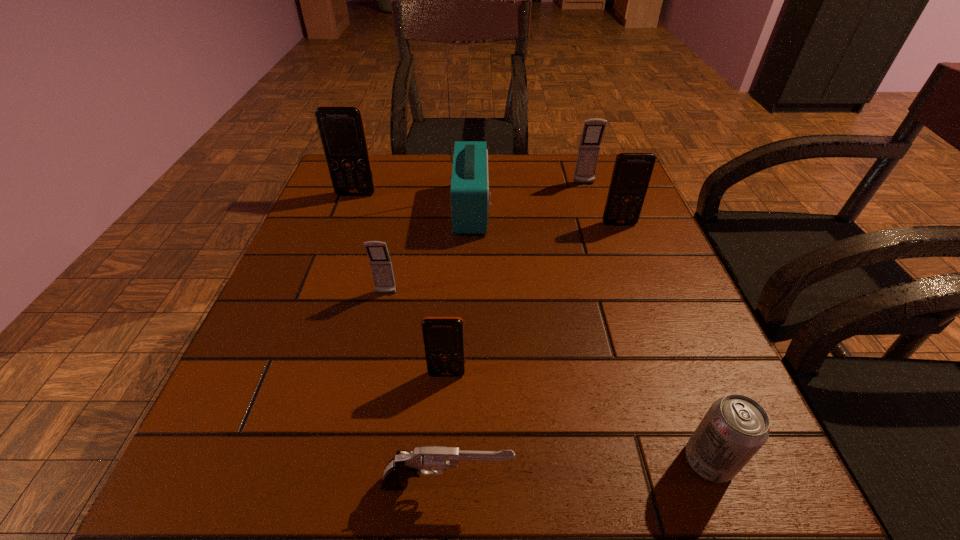
Where is `the left gray cellular telephone`? The image size is (960, 540). the left gray cellular telephone is located at coordinates (380, 262).

You are a GUI agent. You are given a task and a screenshot of the screen. Output one action in this format:
    pyautogui.click(x=<x>, y=<y>)
    Task: Click on the smaller gray cellular telephone
    Image resolution: width=960 pixels, height=540 pixels.
    Given the screenshot: What is the action you would take?
    pyautogui.click(x=380, y=262)

Find the location of `soda can`. soda can is located at coordinates (735, 427).

You are a GUI agent. You are given a task and a screenshot of the screen. Output one action in this format:
    pyautogui.click(x=<x>, y=<y>)
    Task: Click on the shortest object
    
    Given the screenshot: What is the action you would take?
    pyautogui.click(x=404, y=465)

Find the location of a particular element. vacant space situated 0.120m on the front panel of the tallest object is located at coordinates (540, 209).

The width and height of the screenshot is (960, 540). I want to click on free space located on the screen of the biggest orange cellular telephone, so click(x=323, y=282).

Where is `vacant space located 0.170m on the front-facing side of the bigger gray cellular telephone`? This screenshot has width=960, height=540. vacant space located 0.170m on the front-facing side of the bigger gray cellular telephone is located at coordinates (597, 225).

Identify the location of vacant space located 0.170m on the screen of the rightmost orange cellular telephone. Image resolution: width=960 pixels, height=540 pixels. (639, 276).

What are the coordinates of `free region located 0.150m on the screen of the smallest orange cellular telephone` in the screenshot? It's located at pos(441,470).

At what (x,y) coordinates should I click in order to perform the action: click on vacant region located on the front-facing side of the nearer gray cellular telephone. Please return your answer as a coordinate pair (x, y). The image size is (960, 540). Looking at the image, I should click on 338,512.